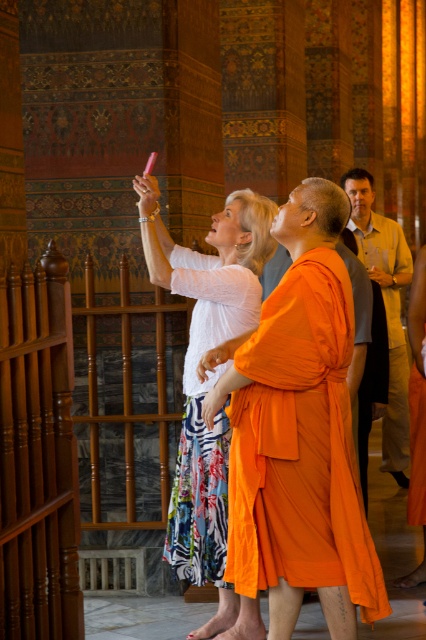
You are standing in the temple and want to find the orange silk robe at center. According to the coordinates provided, where should you look relative to the center of the image?

The orange silk robe at center is located slightly to the right and slightly below the center of the image, at coordinates approximately 0.697 on the x axis and 0.704 on the y axis.

You are standing in the temple and want to take a photo of both the orange silk robe at center and the white cotton blouse at upper left. Which one should you adjust your camera angle to focus on first if you want to include both in the frame?

The orange silk robe at center has a lesser height compared to the white cotton blouse at upper left, so you should focus on the white cotton blouse at upper left first to ensure both are in the frame.

From the picture: You are standing in the temple and need to take a photo of the intricate wall patterns behind the orange silk robe at center and the light beige shirt at right. Can you adjust your position so that both the robe and the shirt are visible in the background without any obstruction?

The orange silk robe at center is in front of the light beige shirt at right, so adjusting your position to the side might allow you to capture both the robe and the shirt in the background without obstruction.